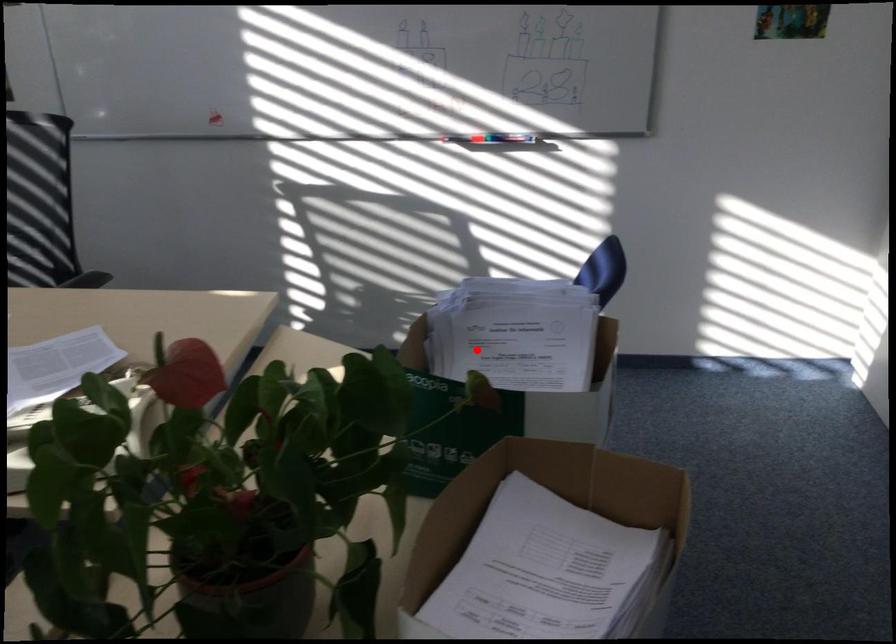
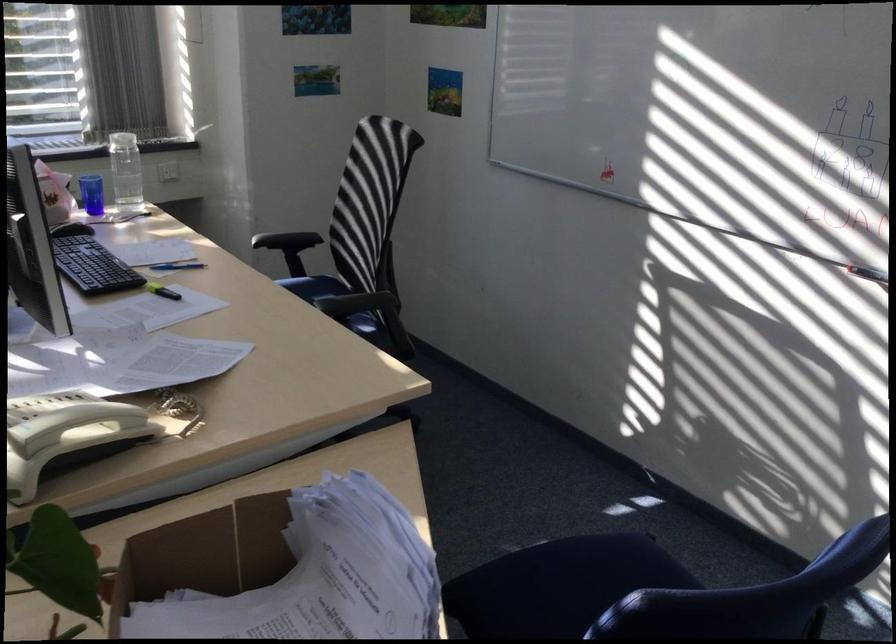
In the second image, find the point that corresponds to the highlighted location in the first image.

(319, 576)